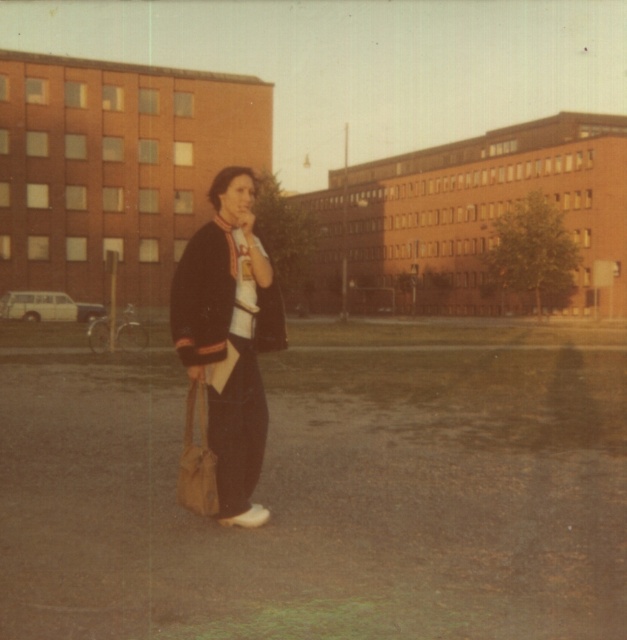
You are a delivery person who needs to deliver a package to the person at point (229,337). What item is located at that point?

The matte black jacket at center is located at point (229,337).